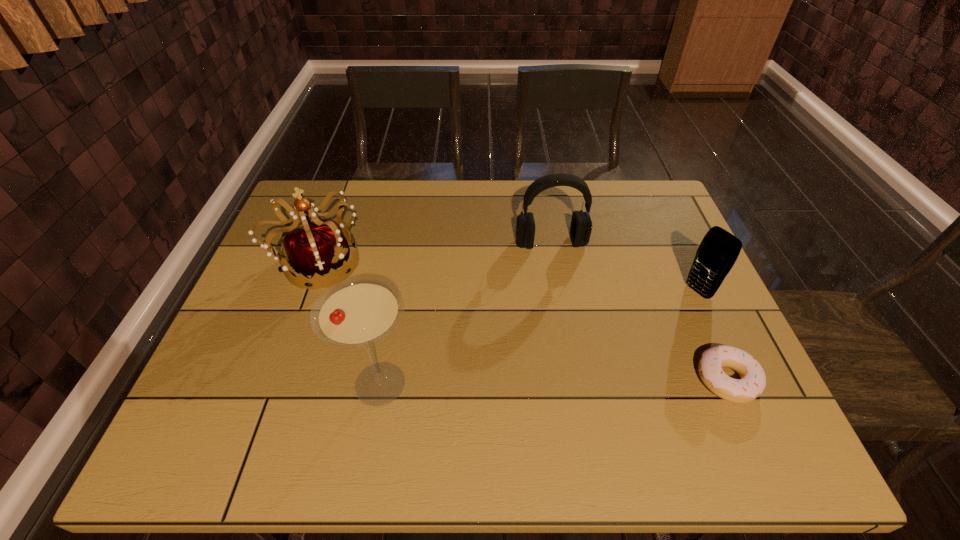
Where is `empty space between the martini and the headset`? The image size is (960, 540). empty space between the martini and the headset is located at coordinates (466, 313).

The image size is (960, 540). Identify the location of empty space between the tiara and the headset. (435, 253).

Where is `free area in between the cellular telephone and the tiara`? The height and width of the screenshot is (540, 960). free area in between the cellular telephone and the tiara is located at coordinates (509, 277).

The height and width of the screenshot is (540, 960). What are the coordinates of `free space between the leftmost object and the headset` in the screenshot? It's located at (435, 253).

This screenshot has width=960, height=540. I want to click on vacant area that lies between the third object from left to right and the tiara, so click(x=435, y=253).

This screenshot has height=540, width=960. Find the location of `free space between the cellular telephone and the headset`. free space between the cellular telephone and the headset is located at coordinates point(624,267).

Identify the location of vacant area between the third object from right to left and the cellular telephone. (624, 267).

You are a GUI agent. You are given a task and a screenshot of the screen. Output one action in this format:
    pyautogui.click(x=<x>, y=<y>)
    Task: Click on the closest object relative to the shortest object
    The width and height of the screenshot is (960, 540).
    Given the screenshot: What is the action you would take?
    pyautogui.click(x=718, y=251)

Choose which object is the third nearest neighbor to the cellular telephone. Please provide its 2D coordinates. Your answer should be formatted as a tuple, i.e. [(x, y)], where the tuple contains the x and y coordinates of a point satisfying the conditions above.

[(356, 312)]

At what (x,y) coordinates should I click in order to perform the action: click on free space that satisfies the following two spatial constraints: 1. on the back side of the headset; 2. on the right side of the tiara. Please return your answer as a coordinate pair (x, y). Looking at the image, I should click on (326, 242).